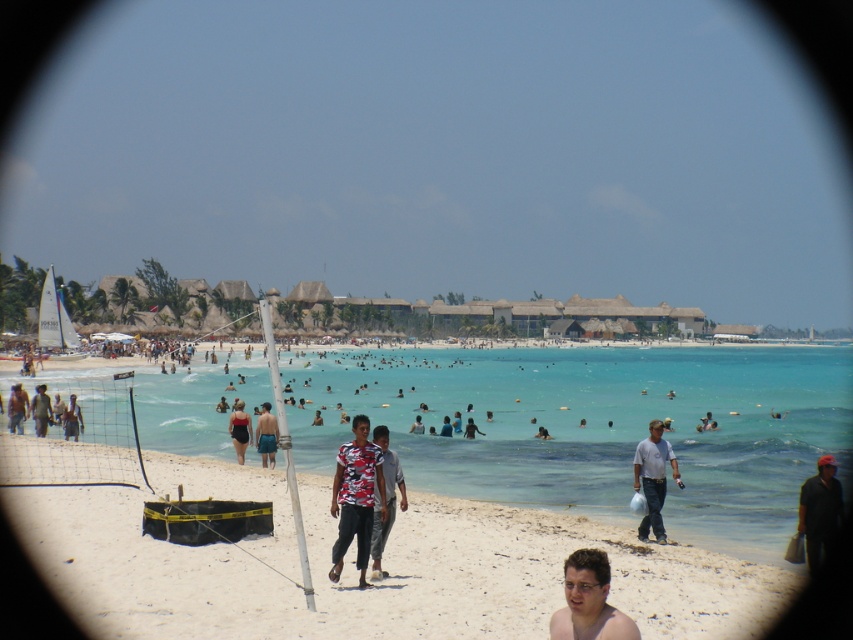
Question: Which object is farther from the camera taking this photo?

Choices:
 (A) camouflage t-shirt at center
 (B) white sandy beach at lower center
 (C) light brown skin at center
 (D) blue denim shorts at center

Answer: (C)

Question: Which point is closer to the camera?

Choices:
 (A) light brown skin at center
 (B) dark gray shirt at lower right

Answer: (B)

Question: Which point is farther from the camera taking this photo?

Choices:
 (A) (590, 563)
 (B) (657, 499)

Answer: (B)

Question: Does white sandy beach at lower center appear on the left side of dark blue shirt at center?

Choices:
 (A) no
 (B) yes

Answer: (A)

Question: Is the position of shiny tan skin at lower center less distant than that of gray cotton shirt at lower right?

Choices:
 (A) yes
 (B) no

Answer: (A)

Question: Does white sandy beach at lower center have a lesser width compared to shiny tan skin at lower center?

Choices:
 (A) no
 (B) yes

Answer: (A)